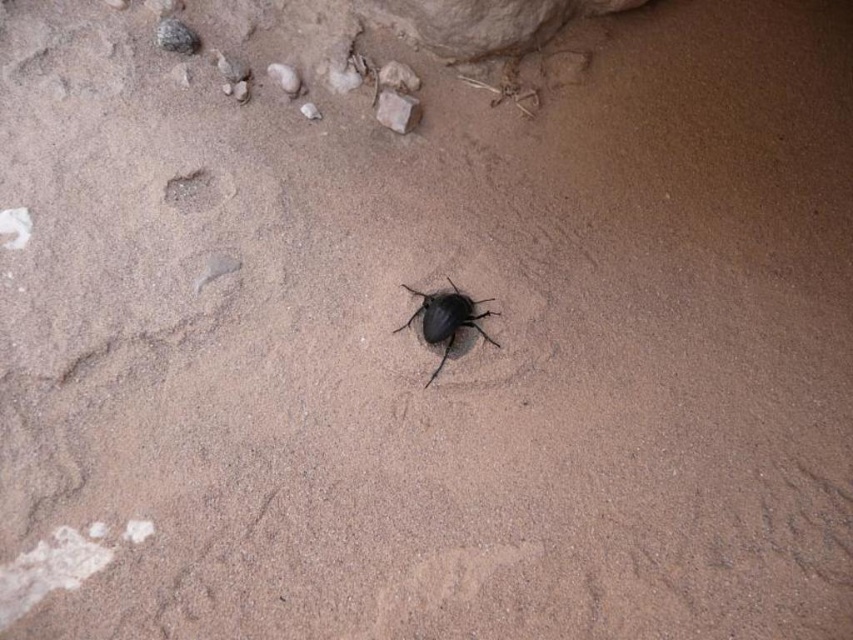
You are a photographer aiming to capture the black matte beetle at center without the smooth brown rock at upper center appearing in the background. Based on the scene description, is this possible?

Yes, since the black matte beetle at center is in front of the smooth brown rock at upper center, adjusting the camera angle to focus on the beetle while excluding the rock in the background would be feasible.

You are a photographer aiming to capture the black matte beetle at center and the smooth brown rock at upper center in a single frame. Based on their positions, which object should you adjust your camera focus on first to ensure both are in the same focal plane?

The black matte beetle at center is to the right of the smooth brown rock at upper center. Since they are positioned horizontally apart, adjusting focus on either object first would require ensuring the camera is focused on the midpoint between them to capture both in the same focal plane.